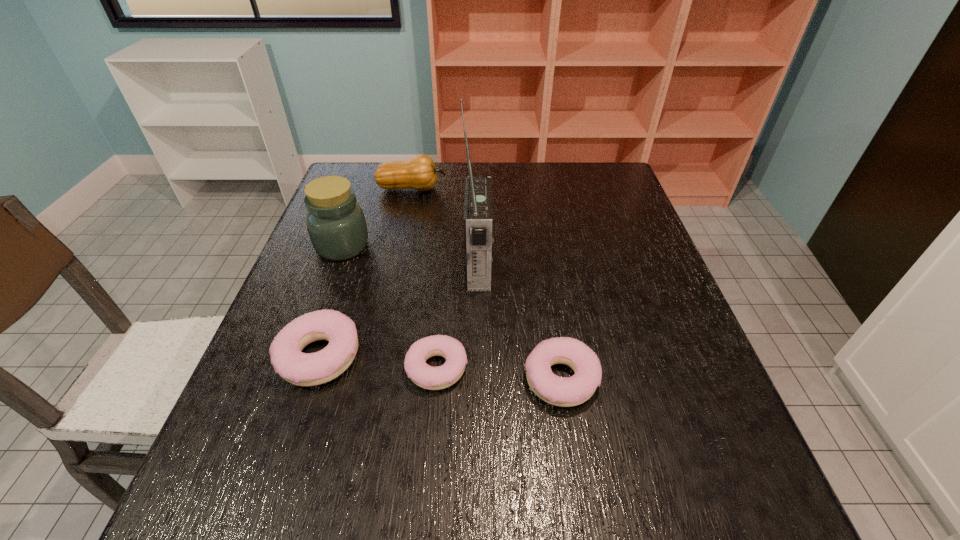
Where is `vacant region that satisfies the following two spatial constraints: 1. on the stem side of the farthest object; 2. on the left side of the shortest object`? vacant region that satisfies the following two spatial constraints: 1. on the stem side of the farthest object; 2. on the left side of the shortest object is located at coordinates (374, 368).

Locate an element on the screen. vacant space that satisfies the following two spatial constraints: 1. on the stem side of the farthest object; 2. on the front side of the jar is located at coordinates (400, 246).

The height and width of the screenshot is (540, 960). What are the coordinates of `free spot that satisfies the following two spatial constraints: 1. on the stem side of the farthest object; 2. on the front side of the leftmost doughnut` in the screenshot? It's located at (376, 357).

Locate an element on the screen. Image resolution: width=960 pixels, height=540 pixels. vacant region that satisfies the following two spatial constraints: 1. on the stem side of the fourth shortest object; 2. on the back side of the shortest doughnut is located at coordinates (374, 368).

Where is `vacant position in the image that satisfies the following two spatial constraints: 1. on the display of the tallest object; 2. on the back side of the rightmost doughnut`? The height and width of the screenshot is (540, 960). vacant position in the image that satisfies the following two spatial constraints: 1. on the display of the tallest object; 2. on the back side of the rightmost doughnut is located at coordinates (477, 380).